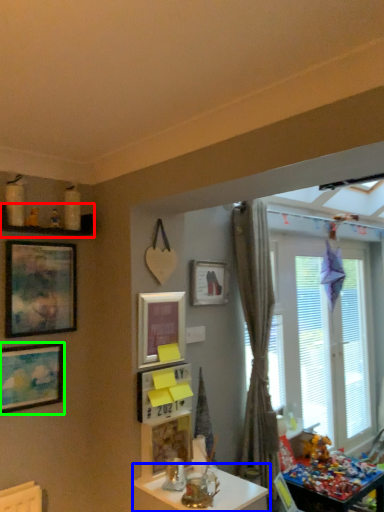
Question: Which is farther away from shelf (highlighted by a red box)? table (highlighted by a blue box) or picture frame (highlighted by a green box)?

Choices:
 (A) table
 (B) picture frame

Answer: (A)